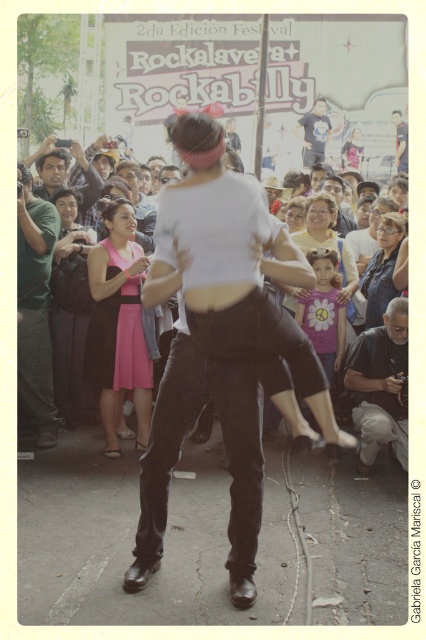
Is matte white shirt at center smaller than dark blue t-shirt at upper center?

Incorrect, matte white shirt at center is not smaller in size than dark blue t-shirt at upper center.

Can you confirm if matte white shirt at center is positioned above dark blue t-shirt at upper center?

No, matte white shirt at center is not above dark blue t-shirt at upper center.

Between point (250, 195) and point (310, 124), which one is positioned behind?

The point (310, 124) is more distant.

Image resolution: width=426 pixels, height=640 pixels. In order to click on matte white shirt at center in this screenshot , I will do `click(216, 346)`.

Can you confirm if matte black dress at left is bigger than dark blue t-shirt at upper center?

Indeed, matte black dress at left has a larger size compared to dark blue t-shirt at upper center.

Between point (60, 364) and point (317, 97), which one is positioned in front?

Point (60, 364)

Is point (77, 241) positioned before point (322, 152)?

Yes, it is in front of point (322, 152).

You are a GUI agent. You are given a task and a screenshot of the screen. Output one action in this format:
    pyautogui.click(x=<x>, y=<y>)
    Task: Click on the matte black dress at left
    The height and width of the screenshot is (640, 426).
    Given the screenshot: What is the action you would take?
    pyautogui.click(x=69, y=314)

Consider the image. Who is positioned more to the left, matte white shirt at center or matte pink dress at center?

Positioned to the left is matte white shirt at center.

Where is `matte white shirt at center`? matte white shirt at center is located at coordinates pyautogui.click(x=216, y=346).